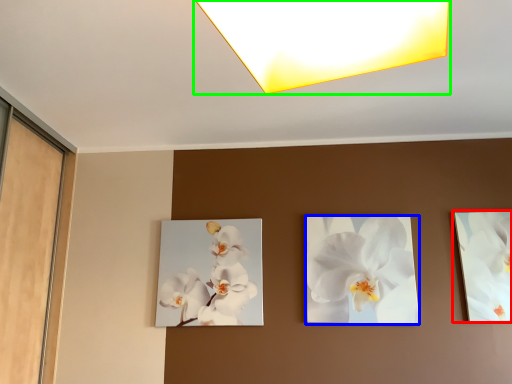
Question: Estimate the real-world distances between objects in this image. Which object is farther from picture frame (highlighted by a red box), flower (highlighted by a blue box) or lamp (highlighted by a green box)?

Choices:
 (A) flower
 (B) lamp

Answer: (B)